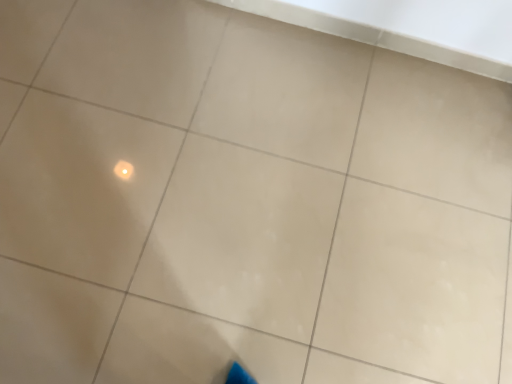
Identify the location of vacant space underneath white glossy bathtub at upper right (from a real-world perspective). (344, 38).